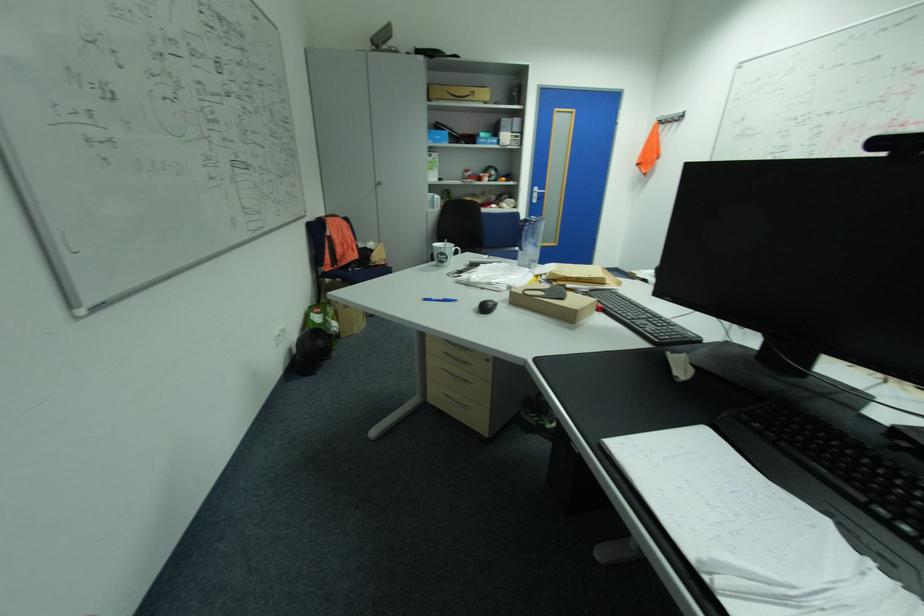
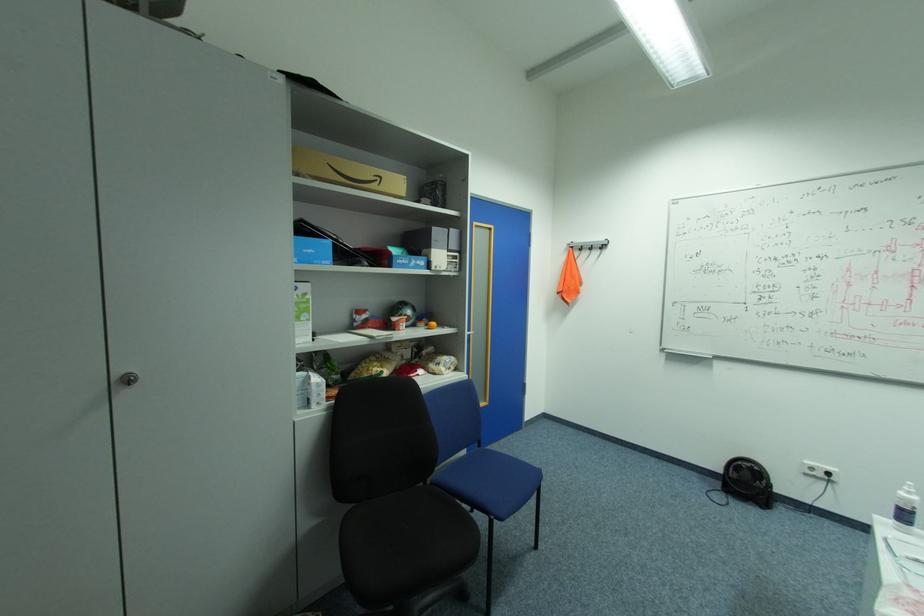
The point at (386, 184) is marked in the first image. Where is the corresponding point in the second image?

(137, 379)